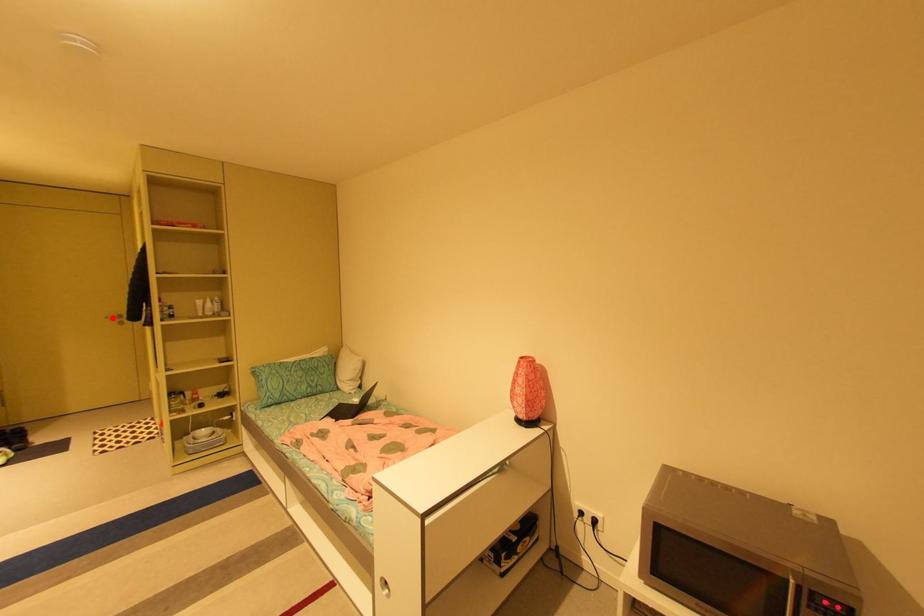
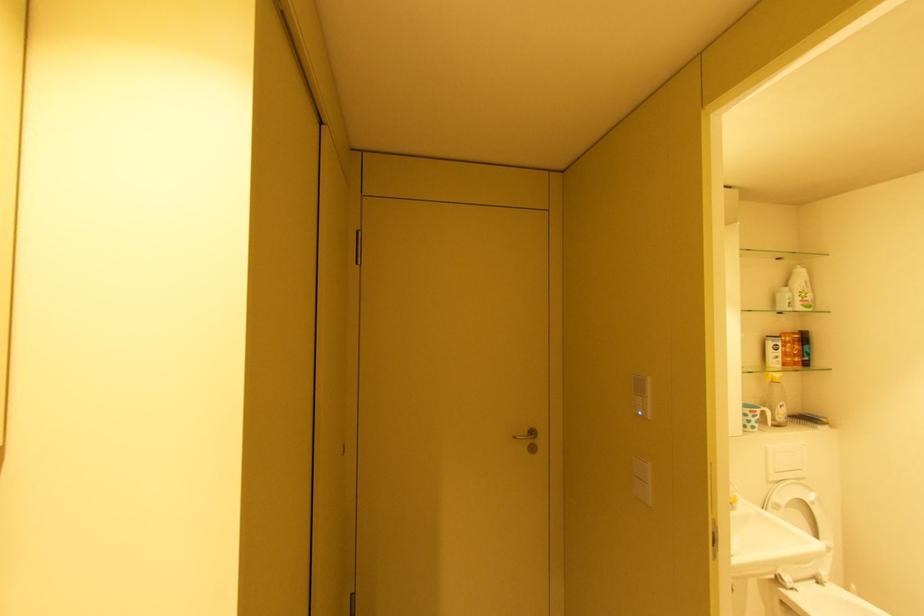
In the second image, find the point that corresponds to the highlighted location in the first image.

(520, 438)